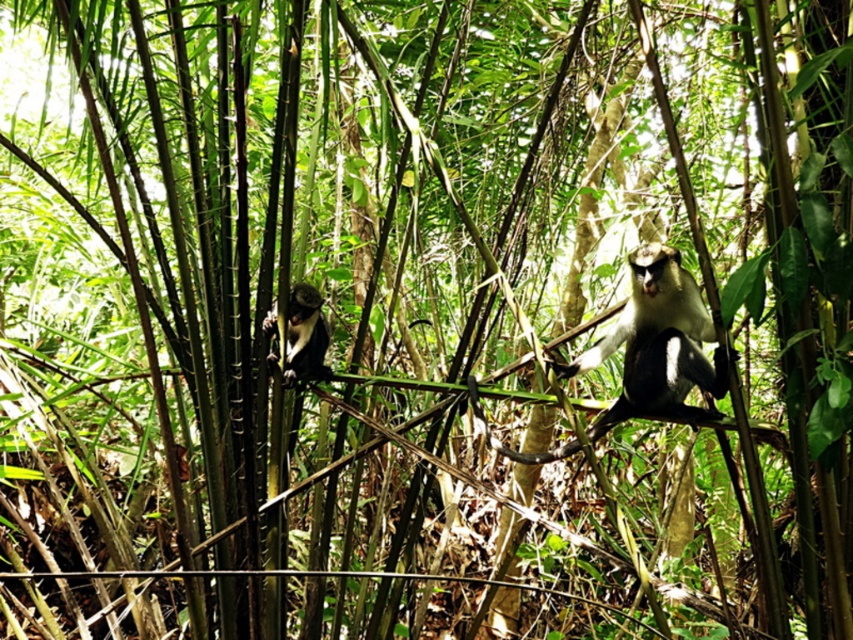
You are a researcher in the forest observing the monkeys. You see a point marked at coordinates (659, 344). Which monkey does this point correspond to?

The point at coordinates (659, 344) corresponds to the white fur monkey at center.

You are a photographer standing at the base of the bamboo grove. You want to take a closeup photo of the white fur monkey at center. Given that your camera has a maximum zoom range of 2.5 meters, will you be able to capture the monkey without moving closer?

The distance between the white fur monkey at center and the camera is 3.17 meters, which exceeds the camera maximum zoom range of 2.5 meters. Therefore, you cannot capture the monkey without moving closer.

You are observing two monkeys in a bamboo forest. The white fur monkey at center and the black fur monkey at left. Which monkey is located higher up in the bamboo grove?

The black fur monkey at left is higher up because the white fur monkey at center is positioned under it.